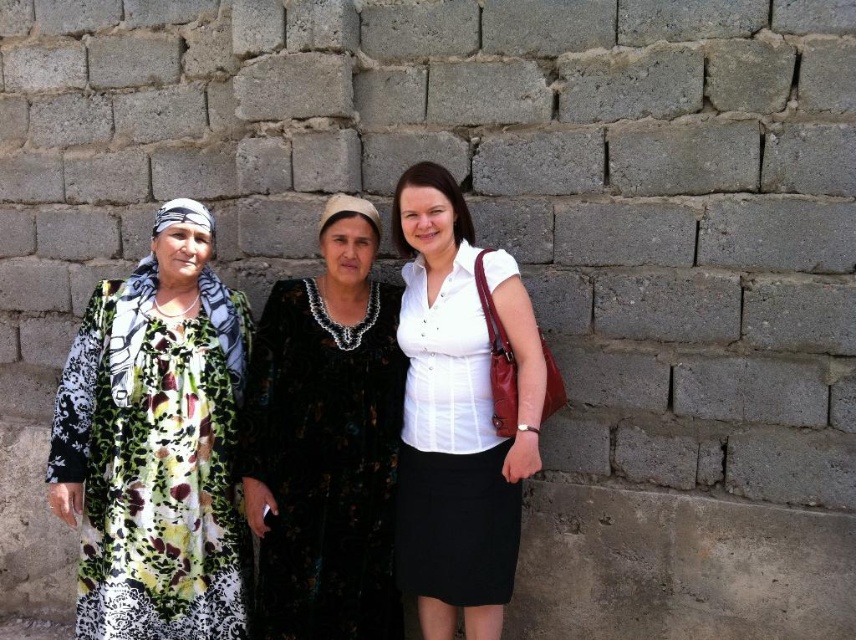
Consider the image. You are a photographer setting up a shoot for a fashion magazine. You have two outfits to feature in the same frame against the brick wall. The outfits are the black floral dress at center and the white matte shirt at center. Given their sizes, which outfit should you position closer to the camera to maintain visual balance?

The black floral dress at center is smaller than the white matte shirt at center, so positioning the smaller black floral dress at center closer to the camera would help balance their sizes in the frame.